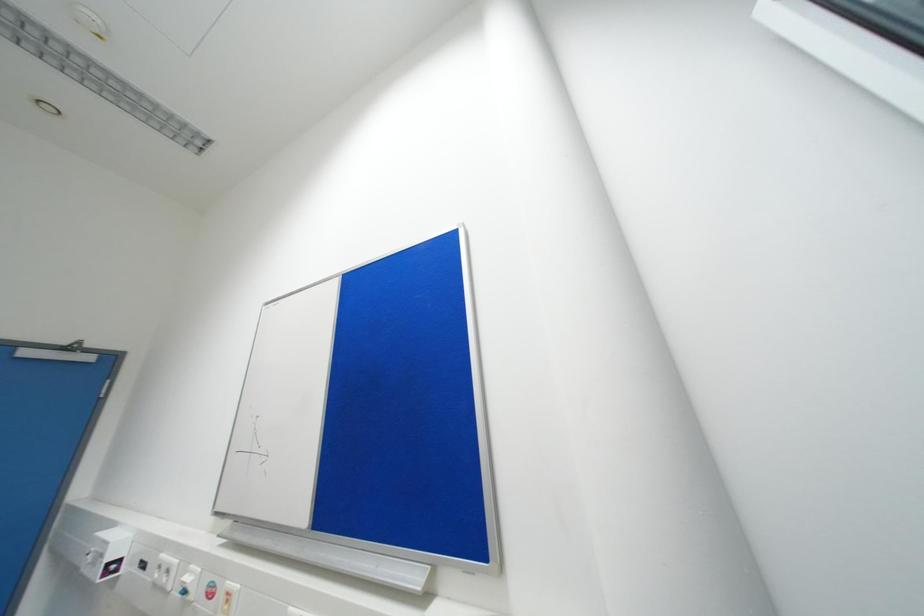
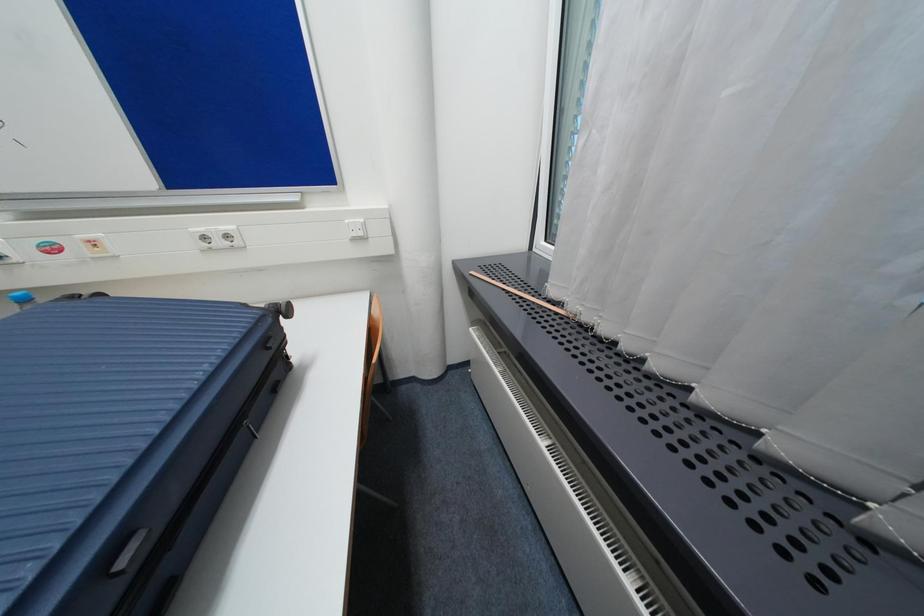
The images are taken continuously from a first-person perspective. In which direction is your viewpoint rotating?

The camera rotated toward right-down.